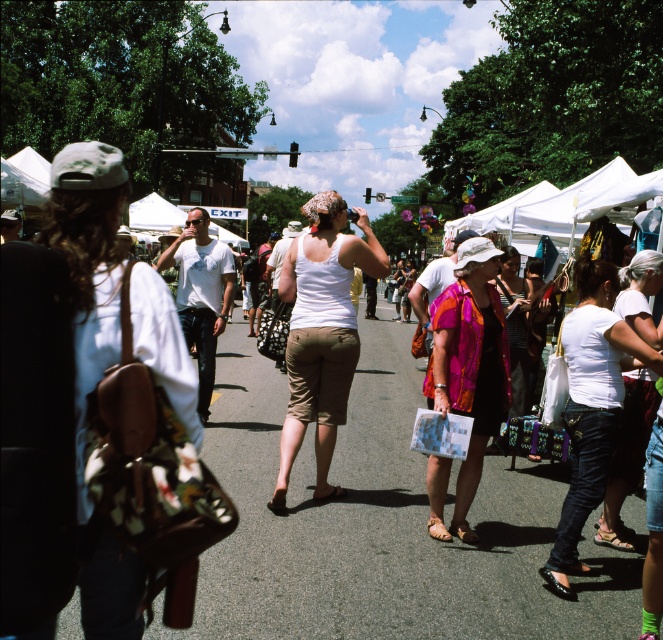
You are standing at the entrance of the market and want to take a photo that includes both the point at coordinates point(575,474) and point(644,444). Which point will appear larger in the photo?

Point(575,474) will appear larger in the photo because it is closer to the camera than point(644,444).

You are a photographer standing at the center of the market. You want to take a photo that includes both the woman in the white matte tank top at center and the vibrant pink and orange patterned shirt woman. Based on their positions, which woman should you position closer to the camera to ensure both are in frame?

The white matte tank top at center is already positioned at the center of the market, so to include both women in the frame, you should position the vibrant pink and orange patterned shirt woman closer to the camera. This way, both subjects will be within the camera view.

You are standing at the entrance of the market and want to locate two specific points marked in the image. The first point is at coordinates point (x=88, y=145) and the second is at point (x=432, y=381). Which point is closer to you?

Point (x=88, y=145) is closer to the viewer than point (x=432, y=381).